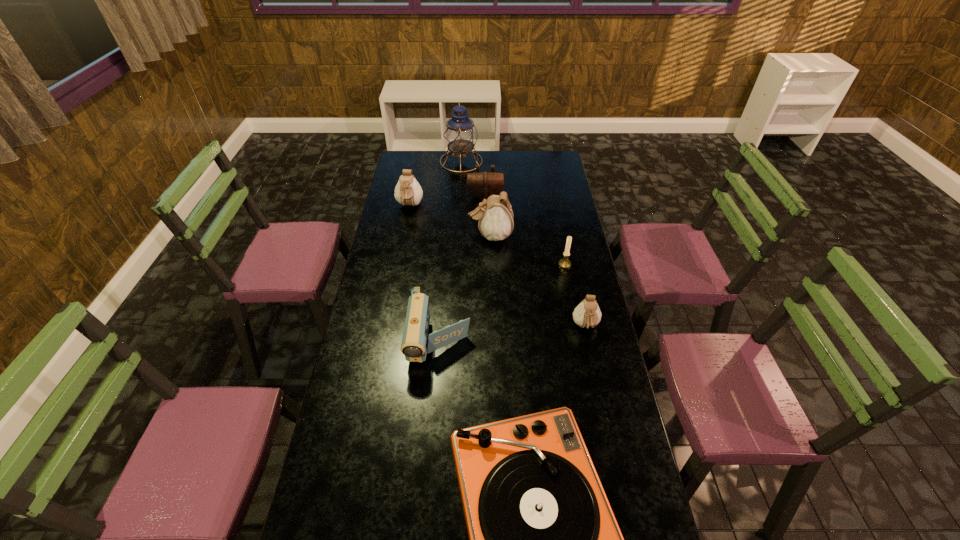
Locate an element on the screen. This screenshot has width=960, height=540. free spot that satisfies the following two spatial constraints: 1. on the front-facing side of the fifth nearest object; 2. on the side of the camcorder with the flip-out screen is located at coordinates (493, 341).

You are a GUI agent. You are given a task and a screenshot of the screen. Output one action in this format:
    pyautogui.click(x=<x>, y=<y>)
    Task: Click on the vacant space that satisfies the following two spatial constraints: 1. on the front-facing side of the lantern; 2. on the back side of the fifth farthest object
    The height and width of the screenshot is (540, 960).
    Given the screenshot: What is the action you would take?
    pyautogui.click(x=455, y=265)

This screenshot has height=540, width=960. What are the coordinates of `vacant region that satisfies the following two spatial constraints: 1. with the flap open on the candle holder; 2. on the left side of the brown pouch` in the screenshot? It's located at (486, 265).

Image resolution: width=960 pixels, height=540 pixels. What are the coordinates of `free location that satisfies the following two spatial constraints: 1. on the front-facing side of the candle holder; 2. on the left side of the lantern` in the screenshot? It's located at (455, 265).